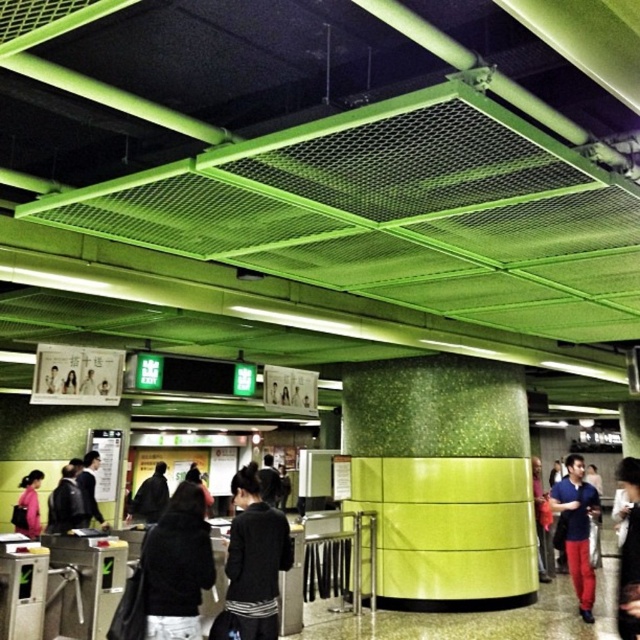
Is leather jacket at center shorter than dark gray jacket at center?

Indeed, leather jacket at center has a lesser height compared to dark gray jacket at center.

Does leather jacket at center have a greater width compared to dark gray jacket at center?

Correct, the width of leather jacket at center exceeds that of dark gray jacket at center.

Who is more forward, (x=56, y=512) or (x=93, y=481)?

Point (x=56, y=512)

Locate an element on the screen. The height and width of the screenshot is (640, 640). leather jacket at center is located at coordinates (65, 500).

Can you confirm if dark blue t-shirt at right is bigger than dark gray jacket at center?

Yes, dark blue t-shirt at right is bigger than dark gray jacket at center.

Can you confirm if dark blue t-shirt at right is positioned to the left of dark gray jacket at center?

No, dark blue t-shirt at right is not to the left of dark gray jacket at center.

You are a GUI agent. You are given a task and a screenshot of the screen. Output one action in this format:
    pyautogui.click(x=<x>, y=<y>)
    Task: Click on the dark blue t-shirt at right
    This screenshot has width=640, height=640.
    Given the screenshot: What is the action you would take?
    pyautogui.click(x=577, y=529)

Is black sweater at center above matte black jacket at center?

Yes, black sweater at center is above matte black jacket at center.

The height and width of the screenshot is (640, 640). What do you see at coordinates (256, 557) in the screenshot?
I see `black sweater at center` at bounding box center [256, 557].

The image size is (640, 640). Identify the location of black sweater at center. pyautogui.click(x=256, y=557).

Identify the location of black sweater at center. The width and height of the screenshot is (640, 640). (256, 557).